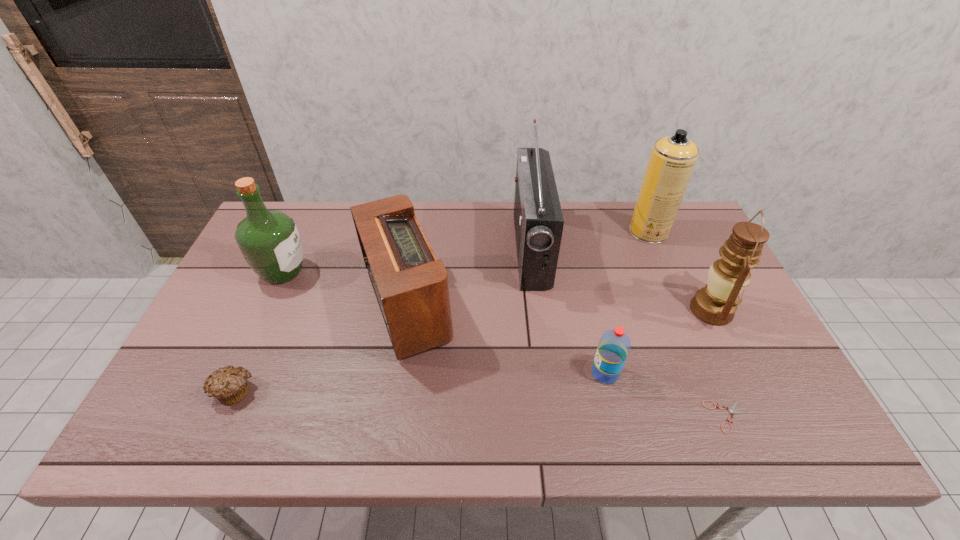
Where is `vacant position in the image that satisfies the following two spatial constraints: 1. on the back side of the shears; 2. on the right side of the oil lamp`? Image resolution: width=960 pixels, height=540 pixels. vacant position in the image that satisfies the following two spatial constraints: 1. on the back side of the shears; 2. on the right side of the oil lamp is located at coordinates (683, 310).

At what (x,y) coordinates should I click in order to perform the action: click on vacant space that satisfies the following two spatial constraints: 1. on the back side of the oil lamp; 2. on the front-facing side of the right radio receiver. Please return your answer as a coordinate pair (x, y). This screenshot has height=540, width=960. Looking at the image, I should click on (683, 250).

Find the location of a particular element. This screenshot has height=540, width=960. free space in the image that satisfies the following two spatial constraints: 1. on the front side of the aerosol can; 2. on the front label of the sixth tallest object is located at coordinates (708, 373).